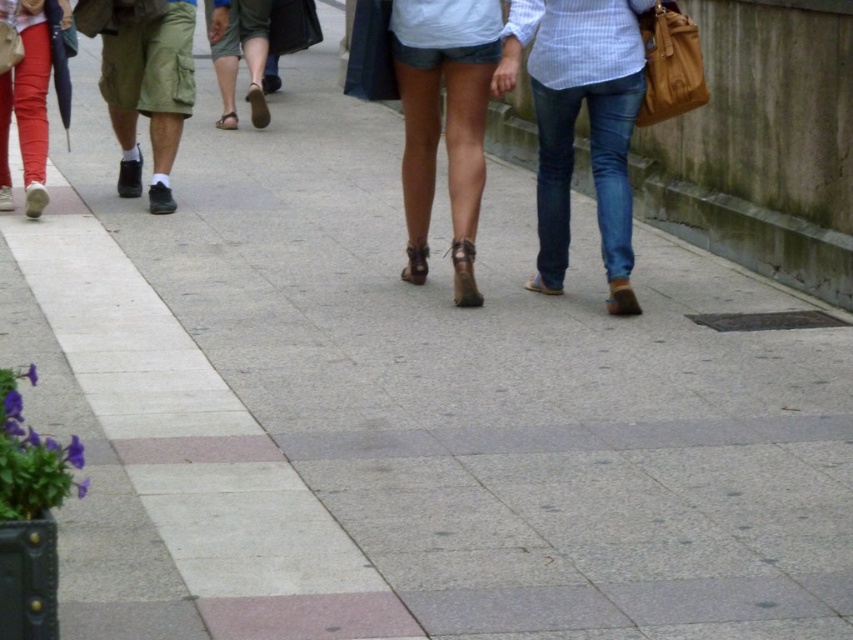
Question: Which point appears farthest from the camera in this image?

Choices:
 (A) (606, 252)
 (B) (128, 92)
 (C) (473, 49)

Answer: (B)

Question: Is blue jeans at center to the right of matte red pants at left from the viewer's perspective?

Choices:
 (A) yes
 (B) no

Answer: (A)

Question: Estimate the real-world distances between objects in this image. Which object is farther from the blue jeans at center?

Choices:
 (A) matte red pants at left
 (B) denim shorts at center

Answer: (A)

Question: Which point is farther to the camera?

Choices:
 (A) blue jeans at center
 (B) green cargo shorts at left

Answer: (B)

Question: Is green cargo shorts at left to the left of matte red pants at left from the viewer's perspective?

Choices:
 (A) yes
 (B) no

Answer: (B)

Question: In this image, where is denim shorts at center located relative to matte red pants at left?

Choices:
 (A) below
 (B) above

Answer: (A)